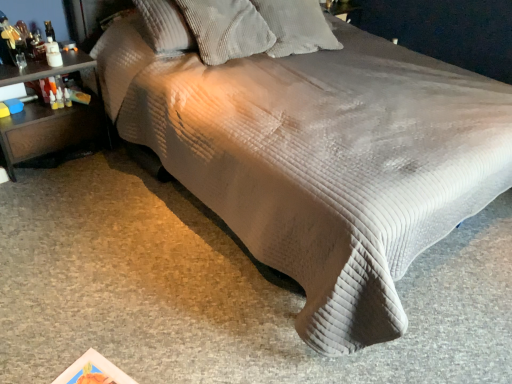
Question: Is white corduroy pillow at upper center, which is counted as the 1th pillow, starting from the right, at the left side of brown wood nightstand at left?

Choices:
 (A) no
 (B) yes

Answer: (A)

Question: Is white corduroy pillow at upper center, which is counted as the 1th pillow, starting from the right, thinner than brown wood nightstand at left?

Choices:
 (A) yes
 (B) no

Answer: (B)

Question: Considering the relative sizes of white corduroy pillow at upper center, which is counted as the 1th pillow, starting from the right, and brown wood nightstand at left in the image provided, is white corduroy pillow at upper center, which is counted as the 1th pillow, starting from the right, taller than brown wood nightstand at left?

Choices:
 (A) no
 (B) yes

Answer: (A)

Question: Would you consider white corduroy pillow at upper center, marked as the second pillow in a left-to-right arrangement, to be distant from brown wood nightstand at left?

Choices:
 (A) yes
 (B) no

Answer: (A)

Question: Considering the relative positions of white corduroy pillow at upper center, marked as the second pillow in a left-to-right arrangement, and brown wood nightstand at left in the image provided, is white corduroy pillow at upper center, marked as the second pillow in a left-to-right arrangement, to the right of brown wood nightstand at left from the viewer's perspective?

Choices:
 (A) yes
 (B) no

Answer: (A)

Question: Is corduroy pillow at upper center, positioned as the first pillow in left-to-right order, situated inside brown wood nightstand at left or outside?

Choices:
 (A) inside
 (B) outside

Answer: (B)

Question: Based on their positions, is corduroy pillow at upper center, positioned as the first pillow in left-to-right order, located to the left or right of brown wood nightstand at left?

Choices:
 (A) right
 (B) left

Answer: (A)

Question: Is corduroy pillow at upper center, positioned as the first pillow in left-to-right order, wider or thinner than brown wood nightstand at left?

Choices:
 (A) thin
 (B) wide

Answer: (B)

Question: From the image's perspective, is corduroy pillow at upper center, positioned as the first pillow in left-to-right order, above or below brown wood nightstand at left?

Choices:
 (A) below
 (B) above

Answer: (B)

Question: In the image, is corduroy pillow at upper center, the second pillow from the right, on the left side or the right side of white corduroy pillow at upper center, which is counted as the 1th pillow, starting from the right?

Choices:
 (A) right
 (B) left

Answer: (B)

Question: From a real-world perspective, relative to white corduroy pillow at upper center, which is counted as the 1th pillow, starting from the right, is corduroy pillow at upper center, positioned as the first pillow in left-to-right order, vertically above or below?

Choices:
 (A) above
 (B) below

Answer: (A)

Question: From the image's perspective, relative to white corduroy pillow at upper center, marked as the second pillow in a left-to-right arrangement, is corduroy pillow at upper center, the second pillow from the right, above or below?

Choices:
 (A) above
 (B) below

Answer: (B)

Question: Looking at their shapes, would you say corduroy pillow at upper center, the second pillow from the right, is wider or thinner than white corduroy pillow at upper center, marked as the second pillow in a left-to-right arrangement?

Choices:
 (A) thin
 (B) wide

Answer: (A)

Question: In terms of width, does brown wood nightstand at left look wider or thinner when compared to white corduroy pillow at upper center, which is counted as the 1th pillow, starting from the right?

Choices:
 (A) wide
 (B) thin

Answer: (B)

Question: From a real-world perspective, is brown wood nightstand at left above or below white corduroy pillow at upper center, marked as the second pillow in a left-to-right arrangement?

Choices:
 (A) below
 (B) above

Answer: (A)